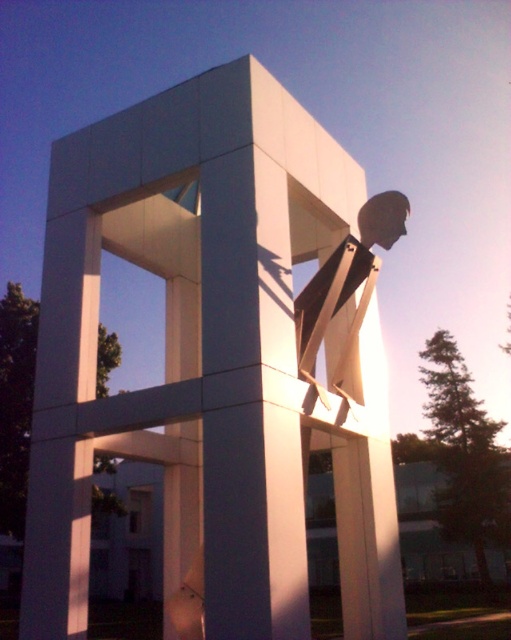
You are an art student analyzing the sculpture. You notice two white matte pieces at the center. Which one is closer to you, the white matte sculpture at center or the white matte statue at center?

The white matte sculpture at center is closer to you because it is in front of the white matte statue at center.

You are standing in front of the sculpture and want to take a photo that captures the entire structure. Given that your camera has a field of view that can cover an area up to 1.2 meters wide, and the sculpture is 1.5 meters wide, will you be able to capture the entire white matte sculpture at center in one shot without moving the camera?

The white matte sculpture at center is 1.5 meters wide, which exceeds the camera field of view of 1.2 meters. Therefore, you will not be able to capture the entire sculpture in one shot without moving the camera.